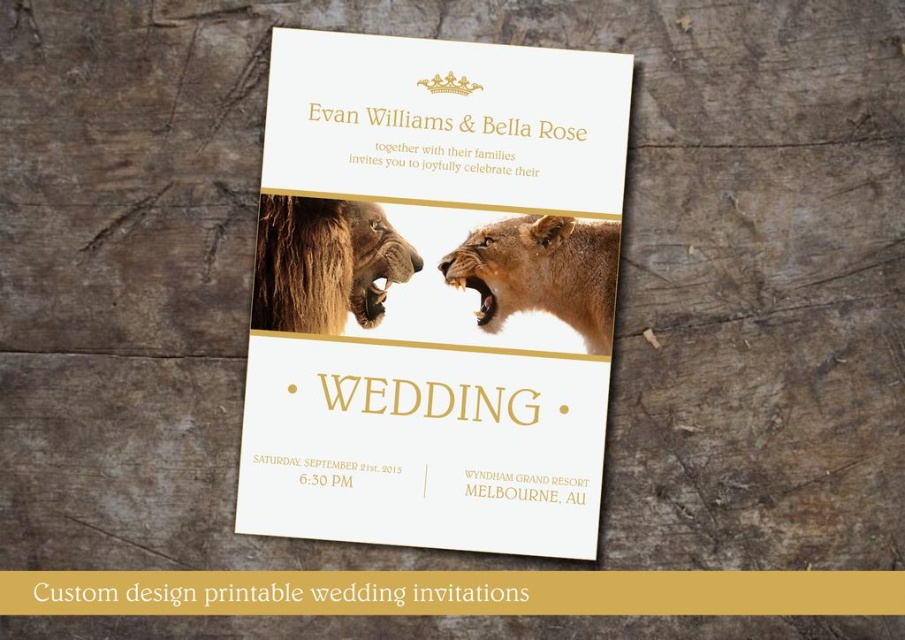
Looking at this image, you are looking at the wedding invitation card. There are two points marked on the card. The first point is at coordinates point (387, 324) and the second is at point (343, 45). Which point is closer to you?

Point (387, 324) is further to the camera than point (343, 45), so the point closer to you is point (343, 45).

You are designing a layout for a wedding invitation and need to place two gold paper elements. The gold paper wedding invitation at center and the gold paper invitation at upper center are both part of the design. Based on their positions, which one is located to the left of the other?

The gold paper wedding invitation at center is positioned on the left side of the gold paper invitation at upper center, so it is located to the left of the other.

You are attending a wedding and notice the gold paper wedding invitation at center and the gold metallic crown at upper center on the invitation card. Which object is positioned higher on the card?

The gold metallic crown at upper center is positioned higher on the card than the gold paper wedding invitation at center.